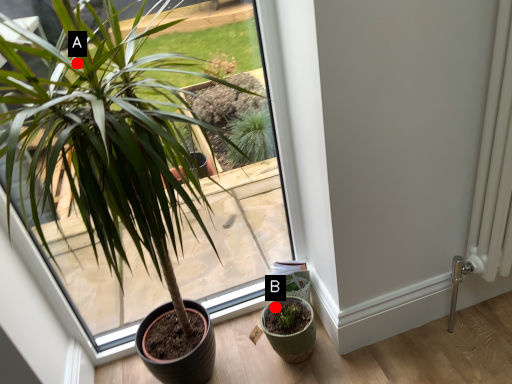
Question: Two points are circled on the image, labeled by A and B beside each circle. Which point is farther from the camera taking this photo?

Choices:
 (A) A is further
 (B) B is further

Answer: (B)